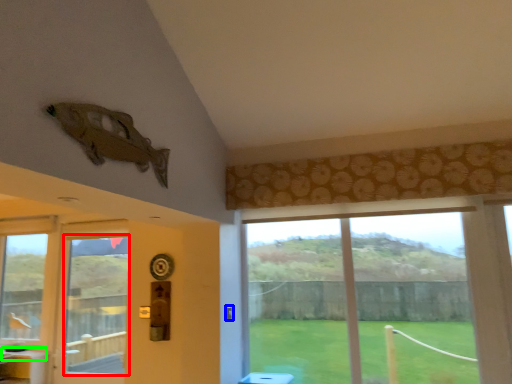
Question: Which is nearer to the window screen (highlighted by a red box)? door handle (highlighted by a blue box) or counter top (highlighted by a green box).

Choices:
 (A) door handle
 (B) counter top

Answer: (B)